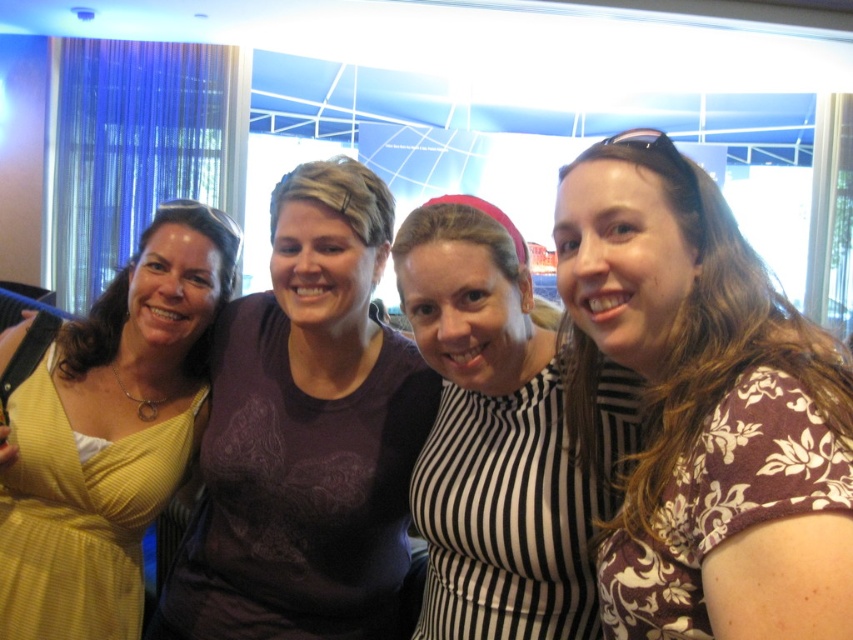
From the picture: You are a photographer at the event and want to capture a photo of the floral print shirt at right and the matte yellow dress at left. Which one is located to the right of the other?

The floral print shirt at right is positioned on the right side of the matte yellow dress at left.

In the image, there are four women posing together. The first woman is wearing a matte yellow dress at left, the second a dark purple floral top, the third a black top, and the fourth a white sweater. A point is marked at coordinates (108, 433). Which woman is closest to this point?

The point at (108, 433) corresponds to the matte yellow dress at left, so the first woman wearing the matte yellow dress at left is closest to this point.

You are a photographer trying to capture a group shot of the women. You want to ensure the floral print shirt at right and the matte purple shirt at center are both visible in the frame. Based on their positions, which shirt should you focus on first to include both in the shot?

The floral print shirt at right is positioned on the right side of the matte purple shirt at center. To include both in the frame, focus on the matte purple shirt at center first as it is centrally located, ensuring the floral print shirt at right remains within the shot to the right.